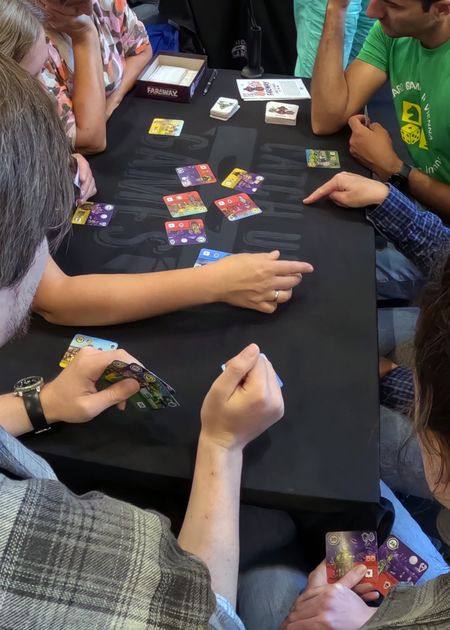
The image size is (450, 630). What are the coordinates of `letters imprinted on black table cloth` in the screenshot? It's located at (275, 159), (281, 145), (122, 241).